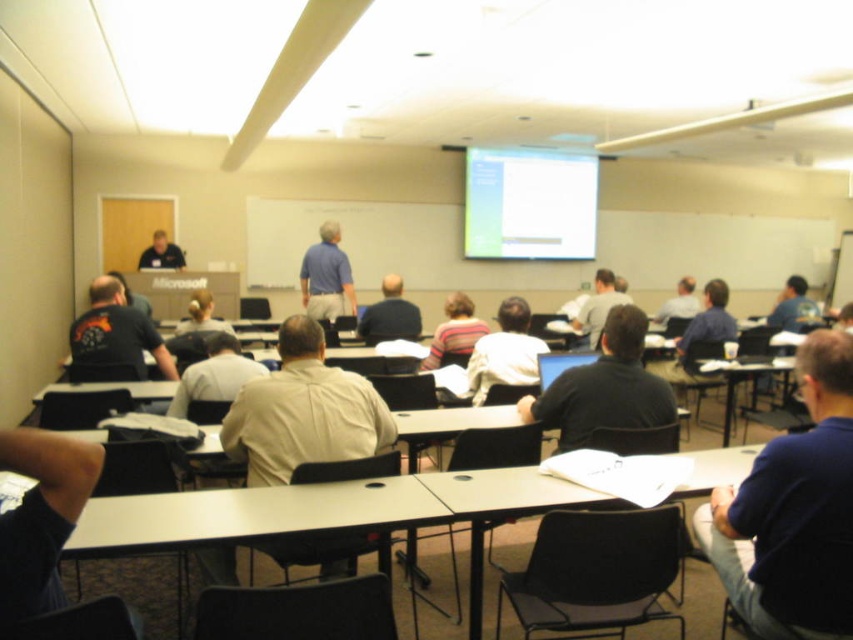
You are sitting at the back of the classroom and want to walk to the front. There are two points marked in the room. Which point should you walk towards first to reach the front faster? The two points are point (x=302, y=404) and point (x=665, y=305).

You should walk towards point (x=302, y=404) first because it is in front of point (x=665, y=305), making it closer to the front of the room.

You are organizing a group photo and need to arrange two people wearing the beige fabric shirt at center and the blue cotton shirt at center side by side. Which shirt should be placed on the left to make the arrangement look balanced?

The beige fabric shirt at center has a larger width than the blue cotton shirt at center, so placing the beige fabric shirt at center on the left and the blue cotton shirt at center on the right would create a balanced arrangement.